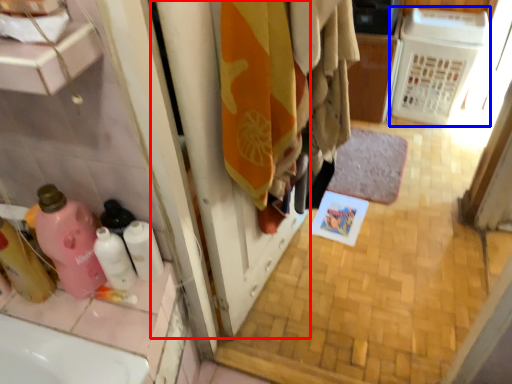
Question: Which object is closer to the camera taking this photo, screen door (highlighted by a red box) or appliance (highlighted by a blue box)?

Choices:
 (A) screen door
 (B) appliance

Answer: (A)